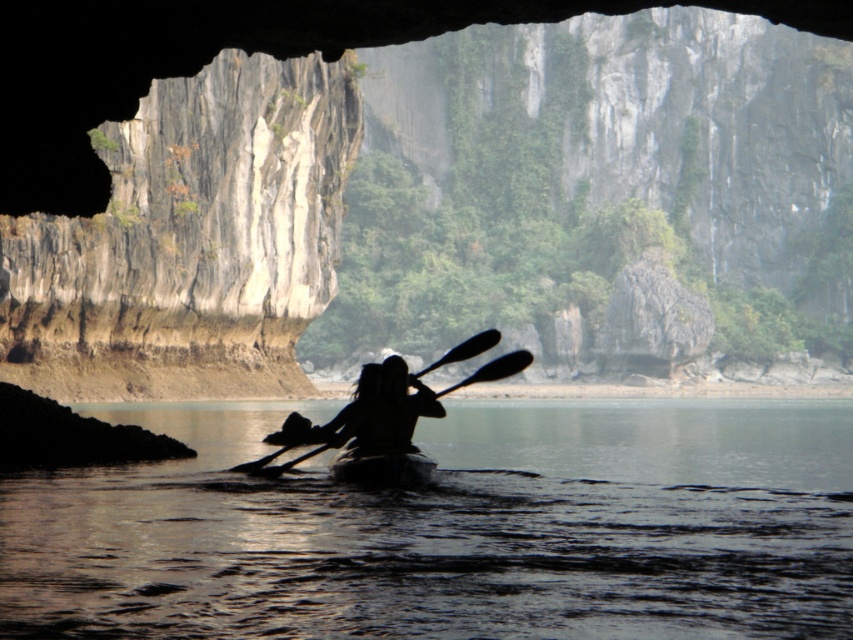
You are navigating a kayak through a narrow cave opening and see two points marked on your GPS. The first point is at point (456,442) and the second point is at point (389,369). Which point should you aim for first if you want to exit the cave in the correct direction?

You should aim for point (389,369) first because point (456,442) is behind it, so following the points in order will help you exit the cave correctly.

You are standing inside the cave and want to reach the transparent water at center. Which direction should you move towards to get there?

The transparent water at center is located at point (451,529), so you should move towards the center of the scene to reach it.